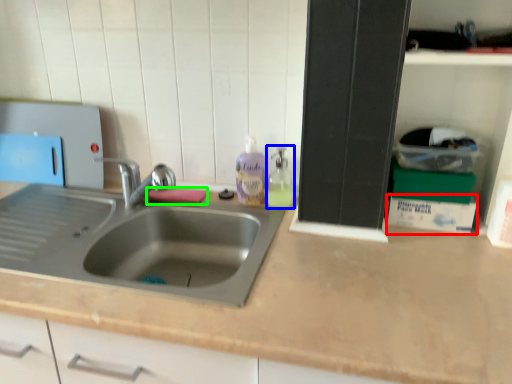
Question: Based on their relative distances, which object is nearer to box (highlighted by a red box)? Choose from soap dispenser (highlighted by a blue box) and soap (highlighted by a green box).

Choices:
 (A) soap dispenser
 (B) soap

Answer: (A)